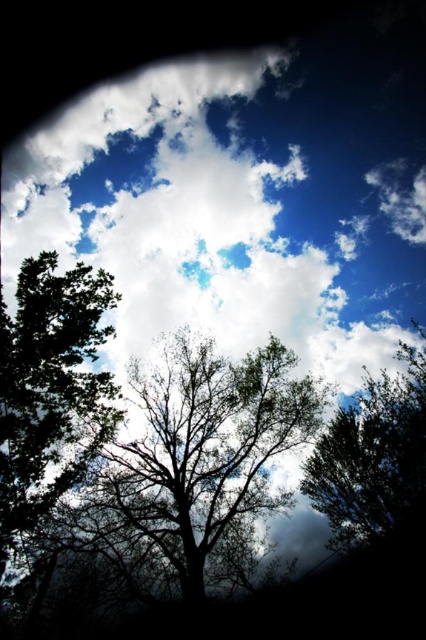
Does silhouette leafy tree at center appear under dark green leafy tree at left?

Indeed, silhouette leafy tree at center is positioned under dark green leafy tree at left.

Based on the photo, is silhouette leafy tree at center shorter than dark green leafy tree at left?

Indeed, silhouette leafy tree at center has a lesser height compared to dark green leafy tree at left.

Describe the element at coordinates (192, 458) in the screenshot. The width and height of the screenshot is (426, 640). I see `silhouette leafy tree at center` at that location.

Identify the location of silhouette leafy tree at center. (192, 458).

Between dark green leafy tree at left and green leafy tree at center, which one has less height?

With less height is dark green leafy tree at left.

Does dark green leafy tree at left have a greater height compared to green leafy tree at center?

Incorrect, dark green leafy tree at left's height is not larger of green leafy tree at center's.

Is point (109, 400) positioned after point (394, 387)?

No, (109, 400) is in front of (394, 387).

Identify the location of dark green leafy tree at left. (49, 388).

The image size is (426, 640). I want to click on silhouette leafy tree at center, so click(x=192, y=458).

Does silhouette leafy tree at center appear over green leafy tree at center?

Actually, silhouette leafy tree at center is below green leafy tree at center.

The image size is (426, 640). Identify the location of silhouette leafy tree at center. coord(192,458).